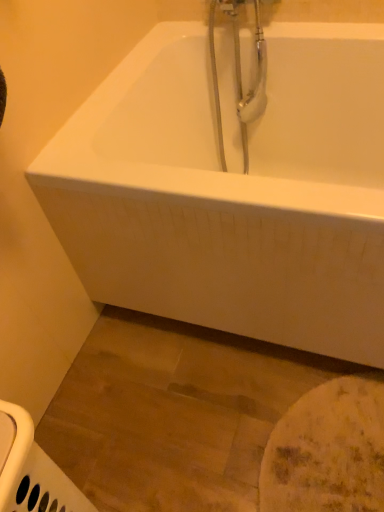
Describe the element at coordinates (240, 75) in the screenshot. This screenshot has width=384, height=512. I see `white ceramic shower at center` at that location.

I want to click on white ceramic shower at center, so click(240, 75).

Locate an element on the screen. The height and width of the screenshot is (512, 384). white ceramic shower at center is located at coordinates (240, 75).